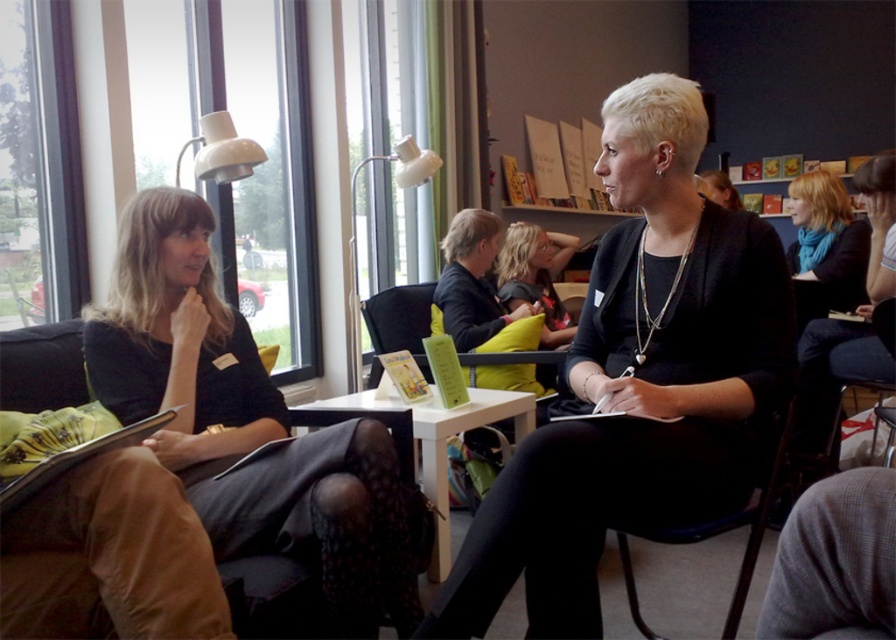
Question: Among these points, which one is nearest to the camera?

Choices:
 (A) (845, 237)
 (B) (143, 385)
 (C) (505, 305)

Answer: (B)

Question: Which object is positioned closest to the matte black jacket at center?

Choices:
 (A) blonde hair at center
 (B) black plastic chair at center
 (C) white glossy table at center

Answer: (B)

Question: Is matte black jacket at center above black plastic chair at center?

Choices:
 (A) no
 (B) yes

Answer: (B)

Question: Can you confirm if matte black jacket at left is positioned below blonde hair scarf at upper right?

Choices:
 (A) no
 (B) yes

Answer: (B)

Question: Does black plastic chair at center lie behind blonde hair at center?

Choices:
 (A) no
 (B) yes

Answer: (A)

Question: Estimate the real-world distances between objects in this image. Which object is farther from the blonde hair scarf at upper right?

Choices:
 (A) matte black jacket at left
 (B) black plastic chair at center
 (C) white glossy table at center
 (D) matte black jacket at center

Answer: (A)